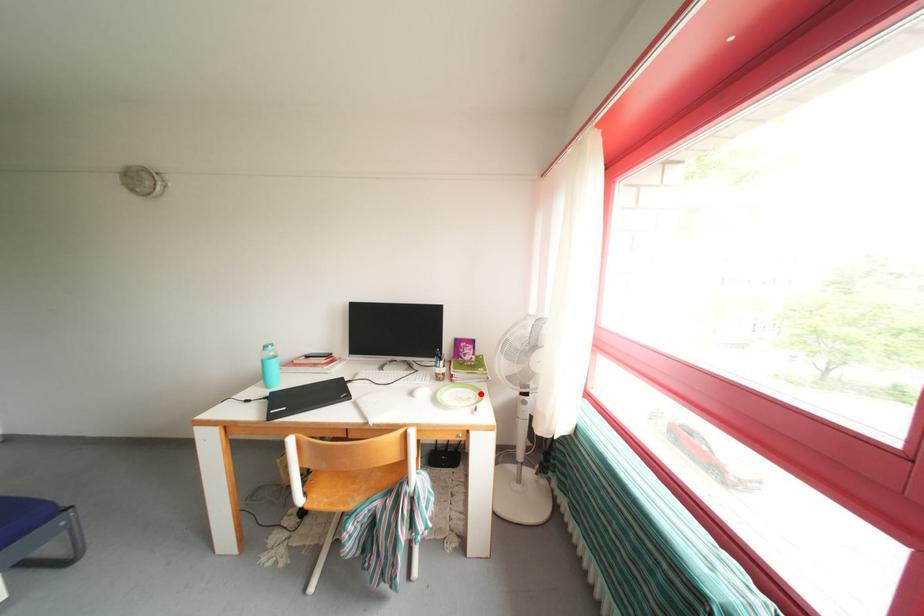
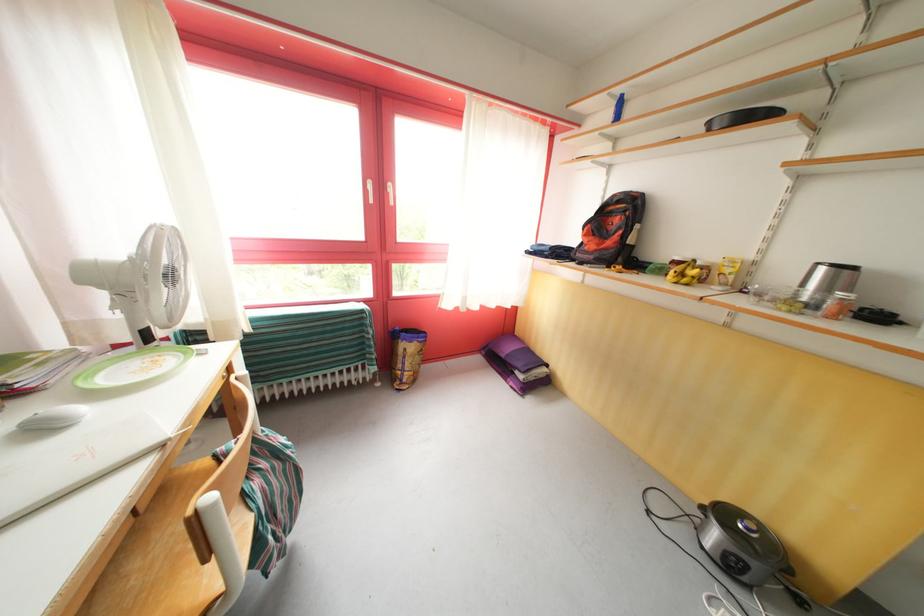
Where in the second image is the point corresponding to the highlighted location from the first image?

(128, 363)